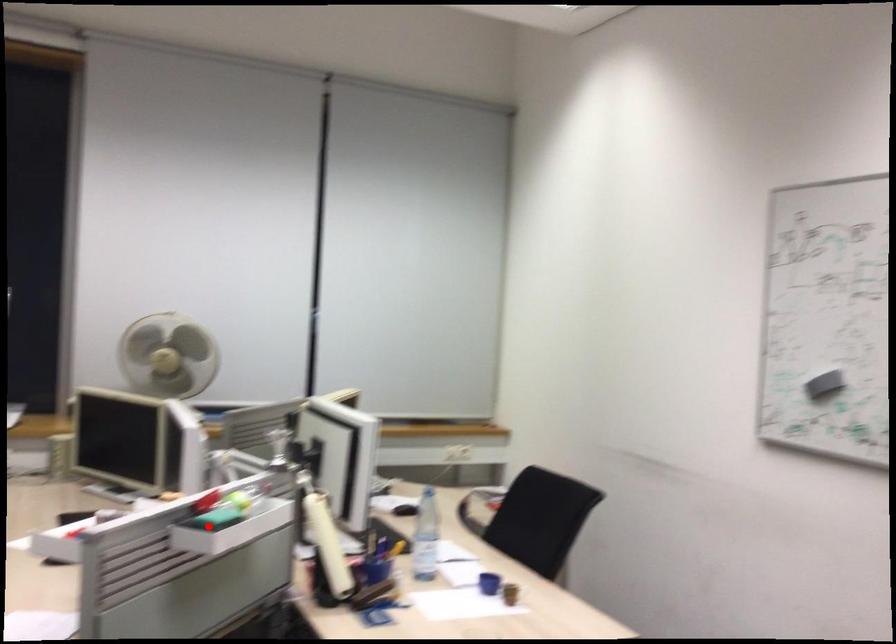
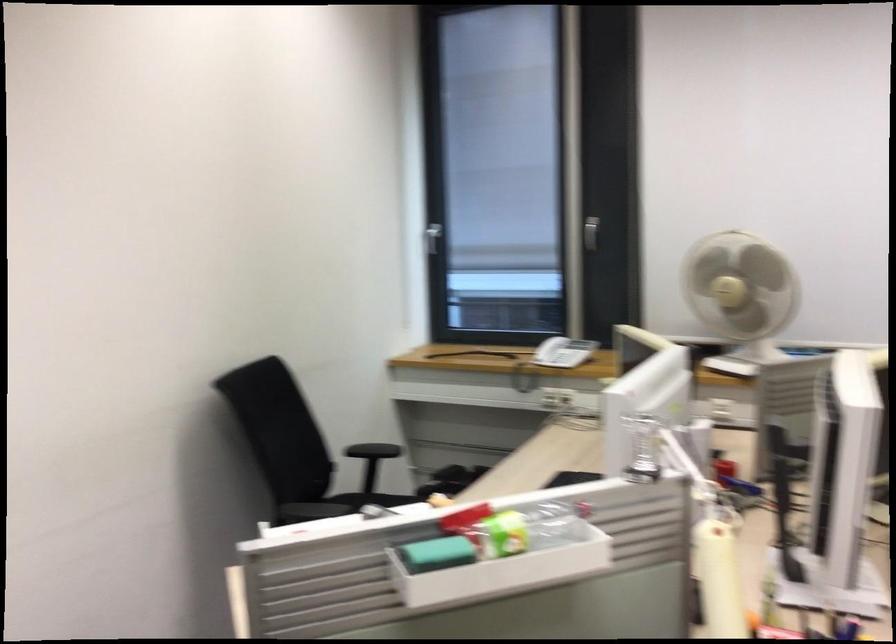
Question: A red point is marked in image1. In image2, is the corresponding 3D point closer to the camera or farther? Reply with the corresponding letter.

Choices:
 (A) The corresponding 3D point is closer.
 (B) The corresponding 3D point is farther.

Answer: (A)